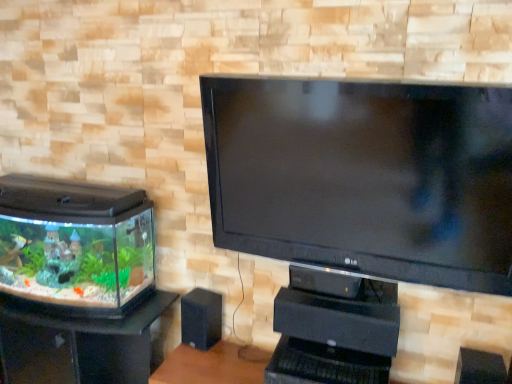
The height and width of the screenshot is (384, 512). Identify the location of free space to the right of black matte speaker at lower center. (233, 348).